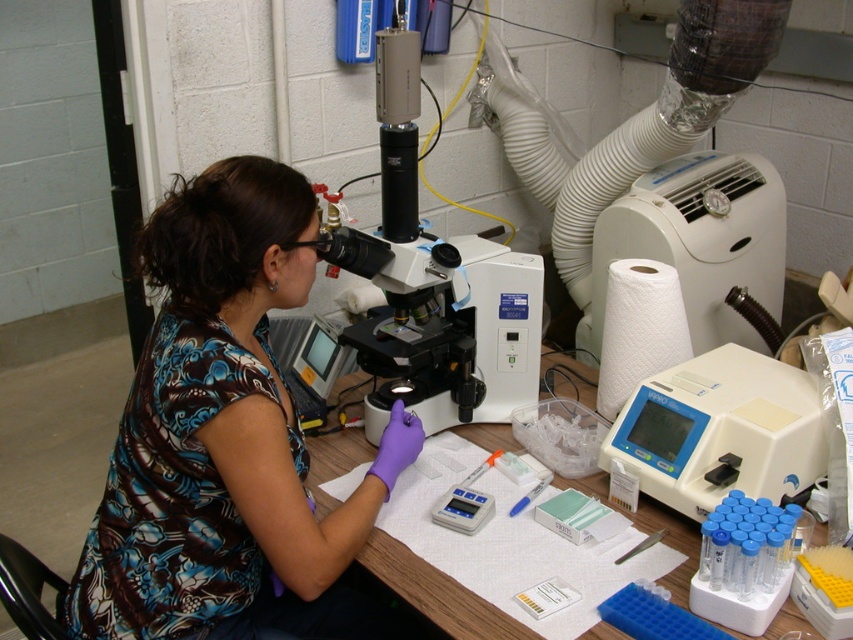
You are a lab assistant trying to locate two specific points on the table in the image. The first point is at coordinates point (526, 326), and the second is at point (541, 488). Which point is closer to you?

Point (526, 326) is further to the camera than point (541, 488), so the second point is closer to you.

You are a lab assistant who needs to move the white plastic microscope at center to the right side of the table. Currently, the floral fabric shirt at center is in the way. Can you move the microscope without moving the shirt?

The floral fabric shirt at center is positioned on the left side of white plastic microscope at center, so the microscope cannot be moved to the right side without moving the shirt first because the shirt is blocking the path to the right.

You are a lab assistant who needs to locate the researcher wearing the floral fabric shirt at center. According to the coordinates given, where would you find the researcher in the image?

The researcher wearing the floral fabric shirt at center is located at the 2D coordinates point (219, 438) in the image.